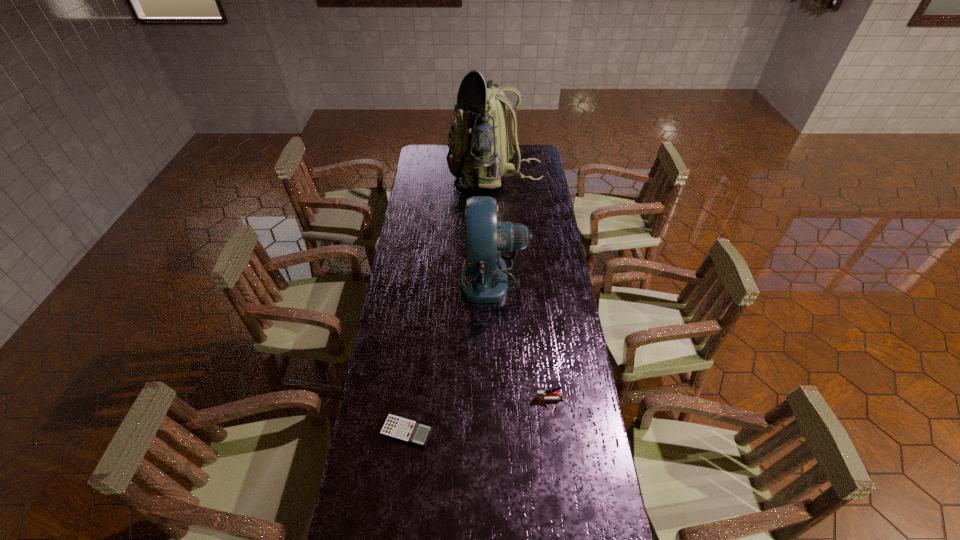
This screenshot has height=540, width=960. In order to click on vacant space situated on the front-facing side of the backpack in this screenshot , I will do `click(421, 178)`.

The height and width of the screenshot is (540, 960). In order to click on vacant region located 0.170m in front of the second farthest object to blow air in this screenshot , I will do `click(420, 277)`.

Identify the location of vacant space located 0.050m in front of the second farthest object to blow air. (449, 277).

You are a GUI agent. You are given a task and a screenshot of the screen. Output one action in this format:
    pyautogui.click(x=<x>, y=<y>)
    Task: Click on the vacant region located 0.290m in front of the second farthest object to blow air
    The height and width of the screenshot is (540, 960).
    Given the screenshot: What is the action you would take?
    pyautogui.click(x=393, y=277)

The image size is (960, 540). Find the location of `vacant space located on the handle side of the stapler`. vacant space located on the handle side of the stapler is located at coordinates (449, 399).

Find the location of a particular element. free space located 0.060m on the handle side of the stapler is located at coordinates (518, 399).

Locate an element on the screen. vacant space located 0.260m on the handle side of the stapler is located at coordinates (458, 399).

Locate an element on the screen. free space located 0.230m on the right of the calculator is located at coordinates (507, 432).

Locate an element on the screen. The width and height of the screenshot is (960, 540). object located in the far edge section of the desktop is located at coordinates click(x=479, y=152).

Locate an element on the screen. This screenshot has width=960, height=540. object that is positioned at the left edge is located at coordinates pyautogui.click(x=416, y=433).